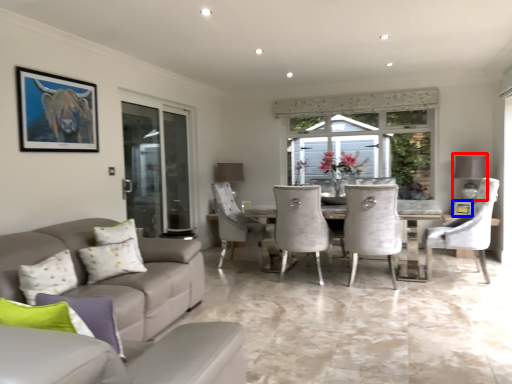
Question: Which object appears farthest to the camera in this image, lamp (highlighted by a red box) or picture frame (highlighted by a blue box)?

Choices:
 (A) lamp
 (B) picture frame

Answer: (B)